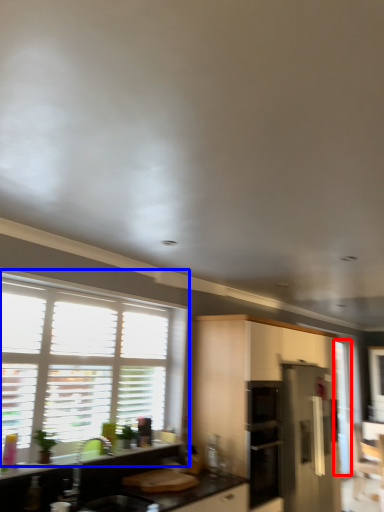
Question: Which object is further to the camera taking this photo, screen door (highlighted by a red box) or window (highlighted by a blue box)?

Choices:
 (A) screen door
 (B) window

Answer: (A)